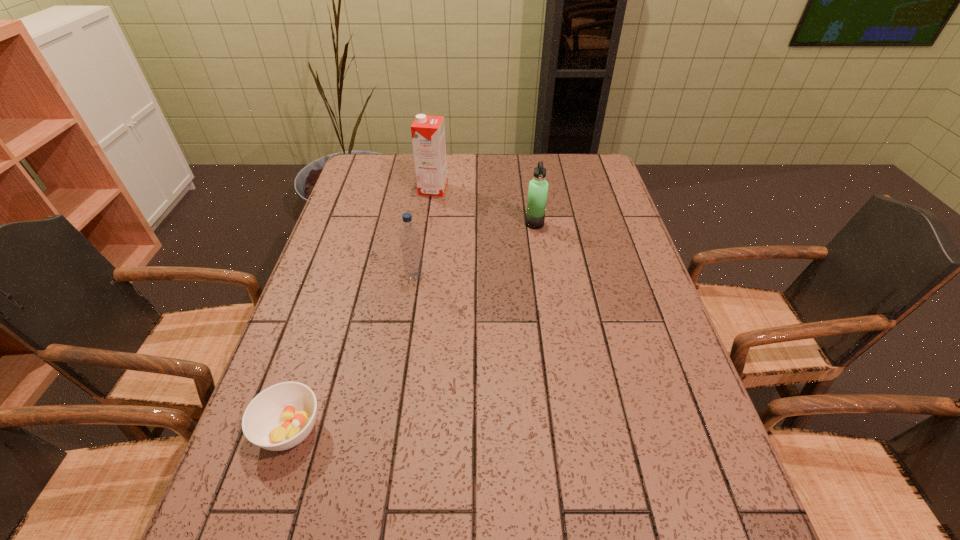
The width and height of the screenshot is (960, 540). I want to click on vacant area that lies between the soup bowl and the rightmost object, so click(x=412, y=327).

Image resolution: width=960 pixels, height=540 pixels. In order to click on free space between the thermos bottle and the farthest object in this screenshot , I will do click(484, 206).

You are a GUI agent. You are given a task and a screenshot of the screen. Output one action in this format:
    pyautogui.click(x=<x>, y=<y>)
    Task: Click on the free space between the nearest object and the thermos bottle
    The height and width of the screenshot is (540, 960).
    Given the screenshot: What is the action you would take?
    pyautogui.click(x=412, y=327)

The height and width of the screenshot is (540, 960). In order to click on free space between the rightmost object and the third farthest object in this screenshot , I will do `click(475, 249)`.

At what (x,y) coordinates should I click in order to perform the action: click on free space between the farthest object and the rightmost object. Please return your answer as a coordinate pair (x, y). This screenshot has width=960, height=540. Looking at the image, I should click on (484, 206).

Find the location of a particular element. Image resolution: width=960 pixels, height=540 pixels. empty location between the thermos bottle and the nearest object is located at coordinates (412, 327).

Locate which object ranks third in proximity to the tallest object. Please provide its 2D coordinates. Your answer should be formatted as a tuple, i.e. [(x, y)], where the tuple contains the x and y coordinates of a point satisfying the conditions above.

[(280, 417)]

Locate an element on the screen. Image resolution: width=960 pixels, height=540 pixels. object that is the third closest to the farthest object is located at coordinates (280, 417).

You are a GUI agent. You are given a task and a screenshot of the screen. Output one action in this format:
    pyautogui.click(x=<x>, y=<y>)
    Task: Click on the vacant space that satisfies the following two spatial constraints: 1. on the back side of the rightmost object; 2. on the left side of the shortest object
    The width and height of the screenshot is (960, 540).
    Given the screenshot: What is the action you would take?
    pyautogui.click(x=357, y=224)

Locate an element on the screen. blank area in the image that satisfies the following two spatial constraints: 1. on the back side of the carton; 2. on the right side of the nearest object is located at coordinates (369, 189).